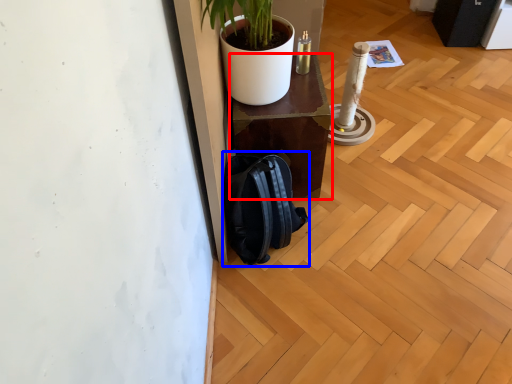
Question: Which point is further to the camera, furniture (highlighted by a red box) or backpack (highlighted by a blue box)?

Choices:
 (A) furniture
 (B) backpack

Answer: (A)